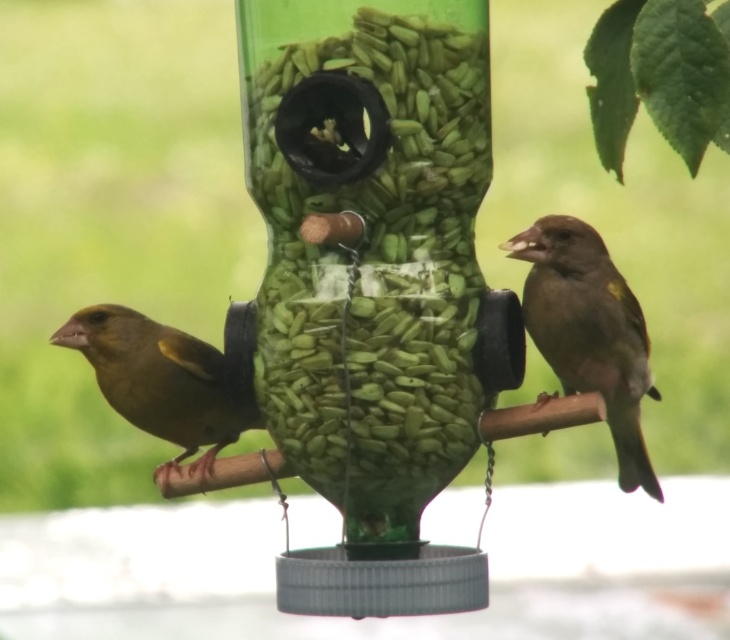
Is green plastic bird feeder at center to the right of green matte bird at left from the viewer's perspective?

Yes, green plastic bird feeder at center is to the right of green matte bird at left.

Which is behind, point (337, 598) or point (153, 380)?

The point (153, 380) is more distant.

Is point (438, 144) behind point (192, 445)?

No, it is not.

What are the coordinates of `green plastic bird feeder at center` in the screenshot? It's located at (372, 284).

Can you confirm if green plastic bird feeder at center is bigger than brown matte sparrow at right?

Indeed, green plastic bird feeder at center has a larger size compared to brown matte sparrow at right.

Between point (407, 248) and point (539, 257), which one is positioned in front?

Point (407, 248)

The width and height of the screenshot is (730, 640). Describe the element at coordinates (372, 284) in the screenshot. I see `green plastic bird feeder at center` at that location.

This screenshot has height=640, width=730. What are the coordinates of `green plastic bird feeder at center` in the screenshot? It's located at (372, 284).

Does brown matte sparrow at right have a greater height compared to green matte bird at left?

Correct, brown matte sparrow at right is much taller as green matte bird at left.

Is brown matte sparrow at right to the left of green matte bird at left from the viewer's perspective?

No, brown matte sparrow at right is not to the left of green matte bird at left.

Who is more forward, (561, 378) or (126, 324)?

Point (561, 378)

This screenshot has width=730, height=640. Identify the location of brown matte sparrow at right. (588, 330).